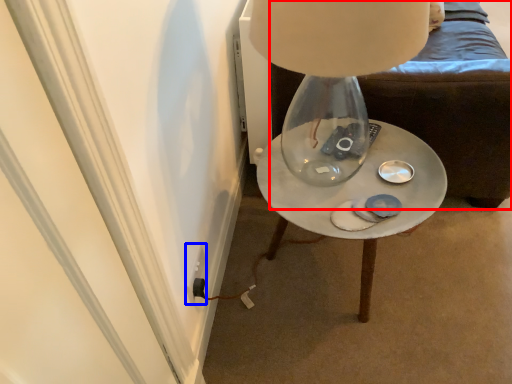
Question: Which of the following is the farthest to the observer, furniture (highlighted by a red box) or electric outlet (highlighted by a blue box)?

Choices:
 (A) furniture
 (B) electric outlet

Answer: (B)